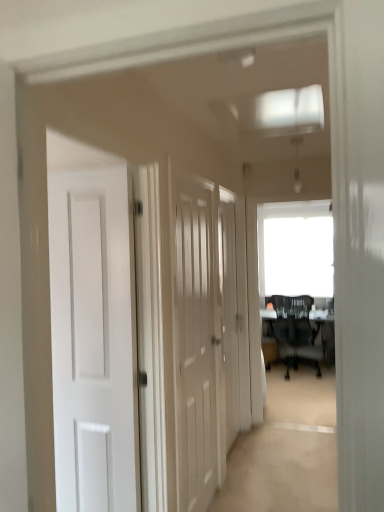
Identify the location of white wood door at center, the 2th door from the back. (195, 345).

From a real-world perspective, which is physically above, black mesh chair at center or white wood door at center, which is counted as the 2th door, starting from the right?

white wood door at center, which is counted as the 2th door, starting from the right, from a real-world perspective.

Based on the photo, is black mesh chair at center aimed at white wood door at center, marked as the 1th door in a front-to-back arrangement?

No, black mesh chair at center is not aimed at white wood door at center, marked as the 1th door in a front-to-back arrangement.

Consider the image. Can you confirm if black mesh chair at center is wider than white wood door at center, which is counted as the 2th door, starting from the right?

Yes.

Does point (295, 355) appear closer or farther from the camera than point (201, 249)?

Point (295, 355) appears to be farther away from the viewer than point (201, 249).

From the image's perspective, which is below, black mesh chair at center or white wood door at center, marked as the 2th door in a front-to-back arrangement?

black mesh chair at center, from the image's perspective.

Which door is the 1st one when counting from the front of the black mesh chair at center? Please provide its 2D coordinates.

[(229, 316)]

Is black mesh chair at center turned away from white wood door at center, which is the first door in right-to-left order?

Yes, black mesh chair at center is facing away from white wood door at center, which is the first door in right-to-left order.

Which is in front, black mesh chair at center or white wood door at center, which is the first door in right-to-left order?

white wood door at center, which is the first door in right-to-left order, is more forward.

From a real-world perspective, is white wood door at center, marked as the 1th door in a front-to-back arrangement, positioned above or below white wood door at center, marked as the 2th door in a left-to-right arrangement?

white wood door at center, marked as the 1th door in a front-to-back arrangement, is above white wood door at center, marked as the 2th door in a left-to-right arrangement.

Considering the sizes of objects white wood door at center, which is counted as the 2th door, starting from the right, and white wood door at center, the first door in the back-to-front sequence, in the image provided, who is taller, white wood door at center, which is counted as the 2th door, starting from the right, or white wood door at center, the first door in the back-to-front sequence,?

With more height is white wood door at center, which is counted as the 2th door, starting from the right.

Consider the image. In terms of width, does white wood door at center, which is counted as the 2th door, starting from the right, look wider or thinner when compared to white wood door at center, which is the first door in right-to-left order?

In the image, white wood door at center, which is counted as the 2th door, starting from the right, appears to be wider than white wood door at center, which is the first door in right-to-left order.

Considering the relative positions of white wood door at center, which is counted as the 2th door, starting from the right, and white wood door at center, which is the first door in right-to-left order, in the image provided, is white wood door at center, which is counted as the 2th door, starting from the right, in front of white wood door at center, which is the first door in right-to-left order,?

Yes, white wood door at center, which is counted as the 2th door, starting from the right, is closer to the viewer.

Looking at the image, does white wood door at center, marked as the 2th door in a left-to-right arrangement, seem bigger or smaller compared to white wood door at center, marked as the 1th door in a front-to-back arrangement?

In the image, white wood door at center, marked as the 2th door in a left-to-right arrangement, appears to be smaller than white wood door at center, marked as the 1th door in a front-to-back arrangement.

Identify the location of door that appears above the white wood door at center, the 1th door viewed from the left (from the image's perspective). The image size is (384, 512). (229, 316).

From the image's perspective, does white wood door at center, marked as the 2th door in a front-to-back arrangement, appear lower than white wood door at center, which is counted as the 2th door, starting from the right?

No, from the image's perspective, white wood door at center, marked as the 2th door in a front-to-back arrangement, is not beneath white wood door at center, which is counted as the 2th door, starting from the right.

Based on their positions, is white wood door at center, the first door in the back-to-front sequence, located to the left or right of white wood door at center, which is counted as the 2th door, starting from the right?

In the image, white wood door at center, the first door in the back-to-front sequence, appears on the right side of white wood door at center, which is counted as the 2th door, starting from the right.

Is white wood door at center, the 1th door viewed from the left, turned away from black mesh chair at center?

No.

Looking at this image, from a real-world perspective, is white wood door at center, the 1th door viewed from the left, on top of black mesh chair at center?

Yes, from a real-world perspective, white wood door at center, the 1th door viewed from the left, is on top of black mesh chair at center.

Does white wood door at center, the 2th door from the back, touch black mesh chair at center?

No, white wood door at center, the 2th door from the back, is not making contact with black mesh chair at center.

Which of these two, white wood door at center, the first door in the back-to-front sequence, or black mesh chair at center, is smaller?

white wood door at center, the first door in the back-to-front sequence, is smaller.

How distant is white wood door at center, marked as the 2th door in a left-to-right arrangement, from black mesh chair at center?

7.62 feet.

Does white wood door at center, the first door in the back-to-front sequence, lie behind black mesh chair at center?

That is False.

Looking at this image, how many degrees apart are the facing directions of white wood door at center, the first door in the back-to-front sequence, and black mesh chair at center?

90.3 degrees.

Find the location of a particular element. This screenshot has height=512, width=384. chair below the white wood door at center, which is counted as the 2th door, starting from the right (from the image's perspective) is located at coordinates (295, 331).

Where is `chair behind the white wood door at center, marked as the 2th door in a front-to-back arrangement`? The image size is (384, 512). chair behind the white wood door at center, marked as the 2th door in a front-to-back arrangement is located at coordinates (295, 331).

From the image, which object appears to be nearer to white wood door at center, marked as the 2th door in a front-to-back arrangement, white wood door at center, the 2th door from the back, or black mesh chair at center?

white wood door at center, the 2th door from the back, is positioned closer to the anchor white wood door at center, marked as the 2th door in a front-to-back arrangement.

Considering their positions, is black mesh chair at center positioned closer to white wood door at center, the first door in the back-to-front sequence, than white wood door at center, the 1th door viewed from the left?

white wood door at center, the 1th door viewed from the left, is positioned closer to the anchor white wood door at center, the first door in the back-to-front sequence.

From the image, which object appears to be farther from white wood door at center, marked as the 1th door in a front-to-back arrangement, white wood door at center, which is the first door in right-to-left order, or black mesh chair at center?

black mesh chair at center is positioned further to the anchor white wood door at center, marked as the 1th door in a front-to-back arrangement.

Based on their spatial positions, is black mesh chair at center or white wood door at center, marked as the 2th door in a left-to-right arrangement, further from white wood door at center, the 2th door from the back?

Based on the image, black mesh chair at center appears to be further to white wood door at center, the 2th door from the back.

Considering their positions, is white wood door at center, marked as the 1th door in a front-to-back arrangement, positioned further to black mesh chair at center than white wood door at center, which is the first door in right-to-left order?

Among the two, white wood door at center, marked as the 1th door in a front-to-back arrangement, is located further to black mesh chair at center.

When comparing their distances from black mesh chair at center, does white wood door at center, which is the first door in right-to-left order, or white wood door at center, the 1th door viewed from the left, seem further?

white wood door at center, the 1th door viewed from the left, lies further to black mesh chair at center than the other object.

The height and width of the screenshot is (512, 384). I want to click on door located between white wood door at center, which is counted as the 2th door, starting from the right, and black mesh chair at center in the depth direction, so click(229, 316).